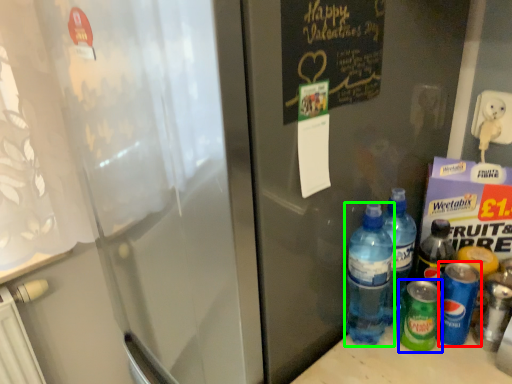
Question: Considering the real-world distances, which object is closest to bottle (highlighted by a red box)? bottle (highlighted by a blue box) or bottle (highlighted by a green box).

Choices:
 (A) bottle
 (B) bottle

Answer: (A)